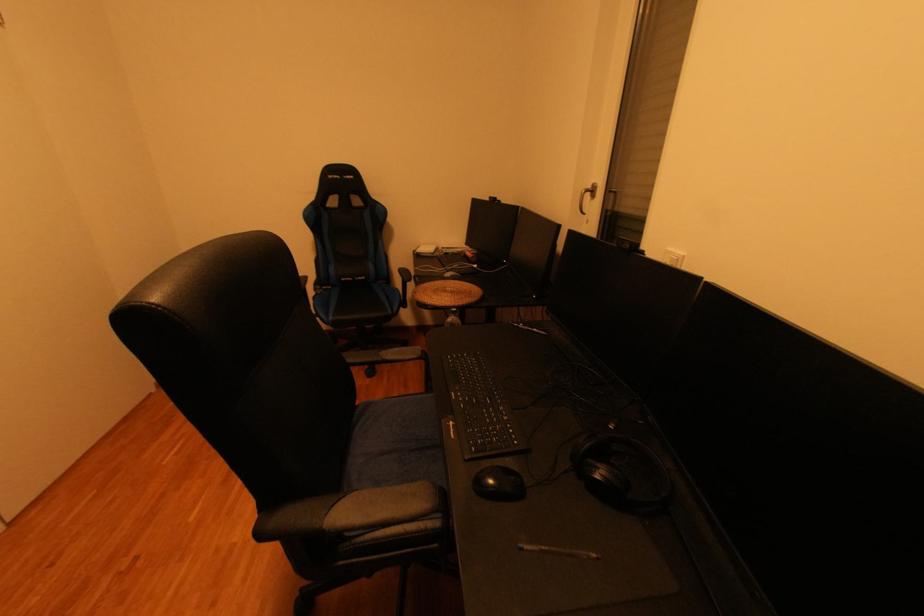
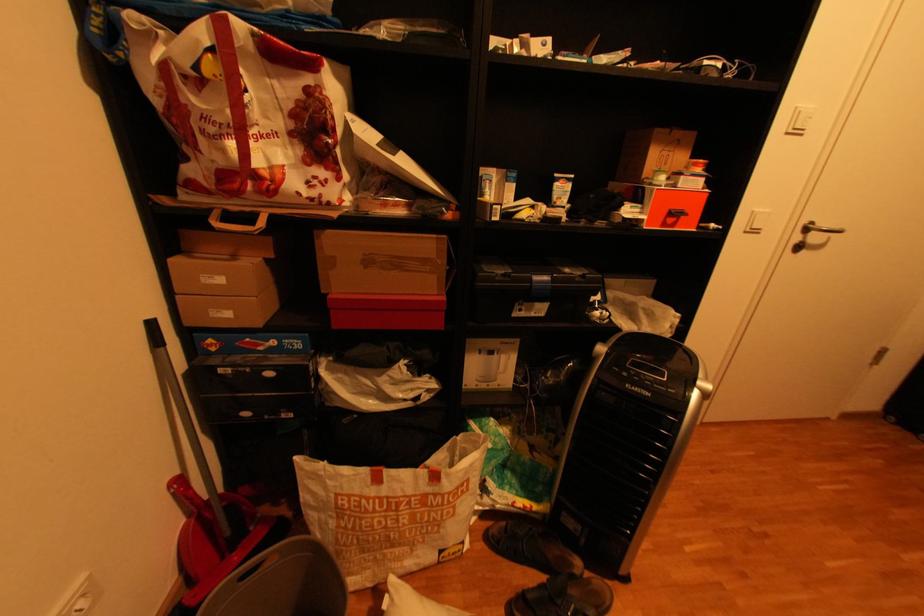
Based on the continuous images, in which direction is the camera rotating?

The camera's rotation is toward left-down.